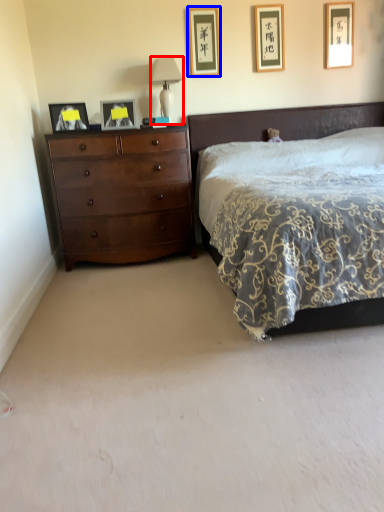
Question: Which object is further to the camera taking this photo, table lamp (highlighted by a red box) or picture frame (highlighted by a blue box)?

Choices:
 (A) table lamp
 (B) picture frame

Answer: (B)